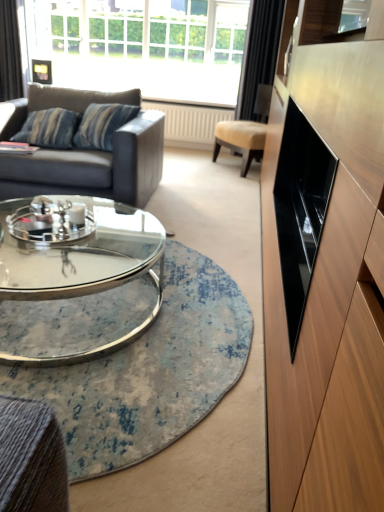
Question: From the image's perspective, is beige leather chair at center over glass/metal coffee table at center?

Choices:
 (A) yes
 (B) no

Answer: (A)

Question: Is beige leather chair at center taller than glass/metal coffee table at center?

Choices:
 (A) no
 (B) yes

Answer: (B)

Question: Can you confirm if beige leather chair at center is positioned to the right of glass/metal coffee table at center?

Choices:
 (A) no
 (B) yes

Answer: (B)

Question: Would you consider beige leather chair at center to be distant from glass/metal coffee table at center?

Choices:
 (A) yes
 (B) no

Answer: (A)

Question: Is beige leather chair at center next to glass/metal coffee table at center?

Choices:
 (A) no
 (B) yes

Answer: (A)

Question: Does beige leather chair at center lie behind glass/metal coffee table at center?

Choices:
 (A) yes
 (B) no

Answer: (A)

Question: Is glass/metal coffee table at center taller than beige leather chair at center?

Choices:
 (A) no
 (B) yes

Answer: (A)

Question: Is glass/metal coffee table at center to the left of beige leather chair at center from the viewer's perspective?

Choices:
 (A) yes
 (B) no

Answer: (A)

Question: Does glass/metal coffee table at center have a lesser height compared to beige leather chair at center?

Choices:
 (A) yes
 (B) no

Answer: (A)

Question: Is glass/metal coffee table at center facing towards beige leather chair at center?

Choices:
 (A) yes
 (B) no

Answer: (B)

Question: Would you say glass/metal coffee table at center contains beige leather chair at center?

Choices:
 (A) no
 (B) yes

Answer: (A)

Question: Is the depth of glass/metal coffee table at center less than that of beige leather chair at center?

Choices:
 (A) no
 (B) yes

Answer: (B)

Question: From a real-world perspective, is white glass window at upper center physically below clear glass coffee table at center?

Choices:
 (A) no
 (B) yes

Answer: (A)